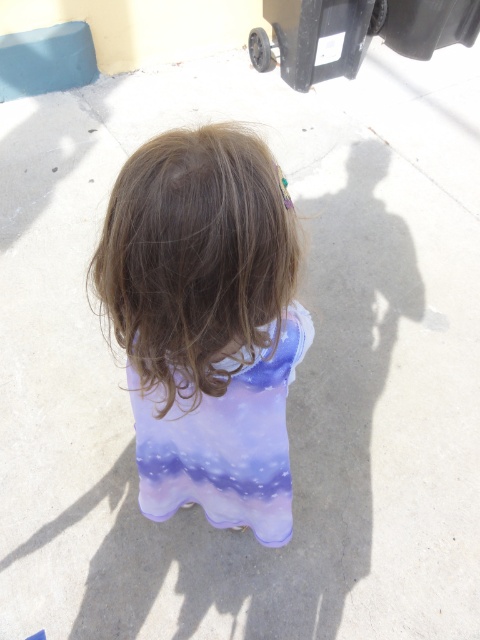
Does brown smooth hair at center have a lesser width compared to purple fabric dress at center?

Correct, brown smooth hair at center's width is less than purple fabric dress at center's.

Is point (169, 204) positioned after point (250, 422)?

No, (169, 204) is closer to viewer.

Describe the element at coordinates (196, 260) in the screenshot. This screenshot has width=480, height=640. I see `brown smooth hair at center` at that location.

The image size is (480, 640). I want to click on brown smooth hair at center, so (196, 260).